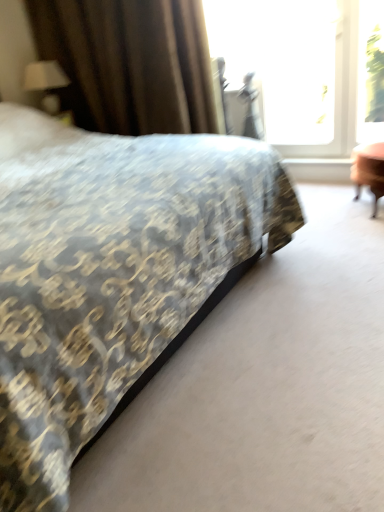
What is the approximate width of transparent glass window screen at upper right?

transparent glass window screen at upper right is 2.65 inches in width.

The width and height of the screenshot is (384, 512). What do you see at coordinates (371, 71) in the screenshot?
I see `transparent glass window screen at upper right` at bounding box center [371, 71].

Locate an element on the screen. This screenshot has height=512, width=384. patterned fabric bed at center is located at coordinates (109, 272).

What is the approximate height of transparent glass window at upper right?

It is 3.99 feet.

Describe the element at coordinates (304, 68) in the screenshot. I see `transparent glass window at upper right` at that location.

This screenshot has width=384, height=512. Describe the element at coordinates (130, 63) in the screenshot. I see `brown textured curtain at upper left` at that location.

Where is `transparent glass window screen at upper right`? This screenshot has width=384, height=512. transparent glass window screen at upper right is located at coordinates (371, 71).

Considering the sizes of objects transparent glass window at upper right and brown textured curtain at upper left in the image provided, who is smaller, transparent glass window at upper right or brown textured curtain at upper left?

transparent glass window at upper right.

Which is in front, transparent glass window at upper right or brown textured curtain at upper left?

Positioned in front is brown textured curtain at upper left.

From the image's perspective, who appears lower, transparent glass window at upper right or brown textured curtain at upper left?

brown textured curtain at upper left is shown below in the image.

Does transparent glass window at upper right have a lesser height compared to brown textured curtain at upper left?

Incorrect, the height of transparent glass window at upper right does not fall short of that of brown textured curtain at upper left.

Based on the photo, from the image's perspective, which one is positioned lower, transparent glass window at upper right or transparent glass window screen at upper right?

transparent glass window screen at upper right, from the image's perspective.

In the image, is transparent glass window at upper right positioned in front of or behind transparent glass window screen at upper right?

In the image, transparent glass window at upper right appears in front of transparent glass window screen at upper right.

From a real-world perspective, does transparent glass window at upper right sit lower than transparent glass window screen at upper right?

Incorrect, from a real-world perspective, transparent glass window at upper right is higher than transparent glass window screen at upper right.

What's the angular difference between transparent glass window at upper right and transparent glass window screen at upper right's facing directions?

The facing directions of transparent glass window at upper right and transparent glass window screen at upper right are 0.00857 degrees apart.

Which of these two, brown textured curtain at upper left or matte white lampshade at upper left, stands taller?

brown textured curtain at upper left.

Is matte white lampshade at upper left a part of brown textured curtain at upper left?

That's correct, matte white lampshade at upper left is inside brown textured curtain at upper left.

Based on their sizes in the image, would you say brown textured curtain at upper left is bigger or smaller than matte white lampshade at upper left?

brown textured curtain at upper left is bigger than matte white lampshade at upper left.

Between brown textured curtain at upper left and matte white lampshade at upper left, which one has smaller width?

matte white lampshade at upper left is thinner.

Measure the distance from transparent glass window at upper right to patterned fabric bed at center.

transparent glass window at upper right and patterned fabric bed at center are 5.85 feet apart from each other.

Between transparent glass window at upper right and patterned fabric bed at center, which one has larger width?

patterned fabric bed at center is wider.

Considering the sizes of objects transparent glass window at upper right and patterned fabric bed at center in the image provided, who is shorter, transparent glass window at upper right or patterned fabric bed at center?

With less height is transparent glass window at upper right.

Between transparent glass window at upper right and patterned fabric bed at center, which one appears on the right side from the viewer's perspective?

transparent glass window at upper right is more to the right.

Is matte white lampshade at upper left directly adjacent to patterned fabric bed at center?

matte white lampshade at upper left and patterned fabric bed at center are not in contact.

Would you say matte white lampshade at upper left contains patterned fabric bed at center?

No, patterned fabric bed at center is not surrounded by matte white lampshade at upper left.

From a real-world perspective, is matte white lampshade at upper left physically located above or below patterned fabric bed at center?

matte white lampshade at upper left is above patterned fabric bed at center.

Between matte white lampshade at upper left and patterned fabric bed at center, which one is positioned in front?

patterned fabric bed at center is closer to the camera.

This screenshot has height=512, width=384. What are the coordinates of `curtain located in front of the matte white lampshade at upper left` in the screenshot? It's located at (130, 63).

Does point (32, 77) appear closer or farther from the camera than point (119, 38)?

Point (32, 77) is farther from the camera than point (119, 38).

Is brown textured curtain at upper left surrounded by matte white lampshade at upper left?

No.

Which is behind, matte white lampshade at upper left or brown textured curtain at upper left?

matte white lampshade at upper left is behind.

From the image's perspective, is matte white lampshade at upper left located above or below transparent glass window at upper right?

matte white lampshade at upper left is below transparent glass window at upper right.

Would you say matte white lampshade at upper left is to the left or to the right of transparent glass window at upper right in the picture?

From the image, it's evident that matte white lampshade at upper left is to the left of transparent glass window at upper right.

Is matte white lampshade at upper left facing towards transparent glass window at upper right?

No, matte white lampshade at upper left does not turn towards transparent glass window at upper right.

You are a GUI agent. You are given a task and a screenshot of the screen. Output one action in this format:
    pyautogui.click(x=<x>, y=<y>)
    Task: Click on the window behind the brown textured curtain at upper left
    This screenshot has height=512, width=384.
    Given the screenshot: What is the action you would take?
    pyautogui.click(x=304, y=68)

Locate an element on the screen. The width and height of the screenshot is (384, 512). window in front of the transparent glass window screen at upper right is located at coordinates [x=304, y=68].

Based on the photo, from the image, which object appears to be nearer to patterned fabric bed at center, transparent glass window screen at upper right or transparent glass window at upper right?

transparent glass window at upper right lies closer to patterned fabric bed at center than the other object.

Looking at this image, when comparing their distances from brown textured curtain at upper left, does patterned fabric bed at center or transparent glass window at upper right seem further?

patterned fabric bed at center is further to brown textured curtain at upper left.

Considering their positions, is brown textured curtain at upper left positioned closer to transparent glass window screen at upper right than transparent glass window at upper right?

transparent glass window at upper right lies closer to transparent glass window screen at upper right than the other object.

Which object lies nearer to the anchor point transparent glass window screen at upper right, patterned fabric bed at center or transparent glass window at upper right?

Among the two, transparent glass window at upper right is located nearer to transparent glass window screen at upper right.

When comparing their distances from matte white lampshade at upper left, does patterned fabric bed at center or transparent glass window screen at upper right seem further?

The object further to matte white lampshade at upper left is transparent glass window screen at upper right.

Looking at the image, which one is located further to patterned fabric bed at center, matte white lampshade at upper left or transparent glass window screen at upper right?

transparent glass window screen at upper right lies further to patterned fabric bed at center than the other object.

Which object lies nearer to the anchor point patterned fabric bed at center, matte white lampshade at upper left or brown textured curtain at upper left?

The object closer to patterned fabric bed at center is brown textured curtain at upper left.

Estimate the real-world distances between objects in this image. Which object is further from transparent glass window screen at upper right, patterned fabric bed at center or brown textured curtain at upper left?

patterned fabric bed at center.

Where is `window between patterned fabric bed at center and matte white lampshade at upper left in the front-back direction`? Image resolution: width=384 pixels, height=512 pixels. window between patterned fabric bed at center and matte white lampshade at upper left in the front-back direction is located at coordinates (304, 68).

Locate an element on the screen. This screenshot has height=512, width=384. window screen positioned between patterned fabric bed at center and matte white lampshade at upper left from near to far is located at coordinates (371, 71).

Where is `window between brown textured curtain at upper left and transparent glass window screen at upper right in the horizontal direction`? The height and width of the screenshot is (512, 384). window between brown textured curtain at upper left and transparent glass window screen at upper right in the horizontal direction is located at coordinates (304, 68).

This screenshot has height=512, width=384. Identify the location of window located between patterned fabric bed at center and transparent glass window screen at upper right in the depth direction. (304, 68).